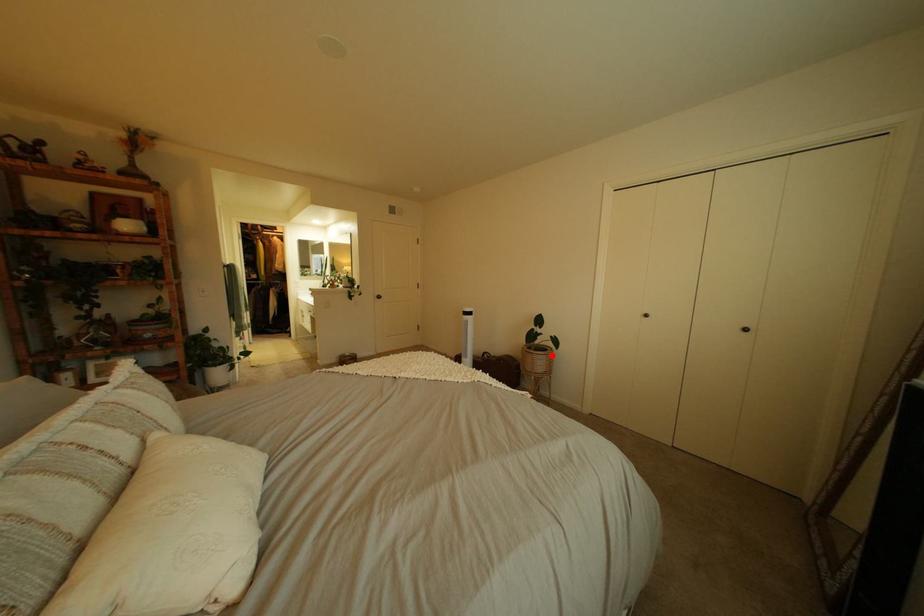
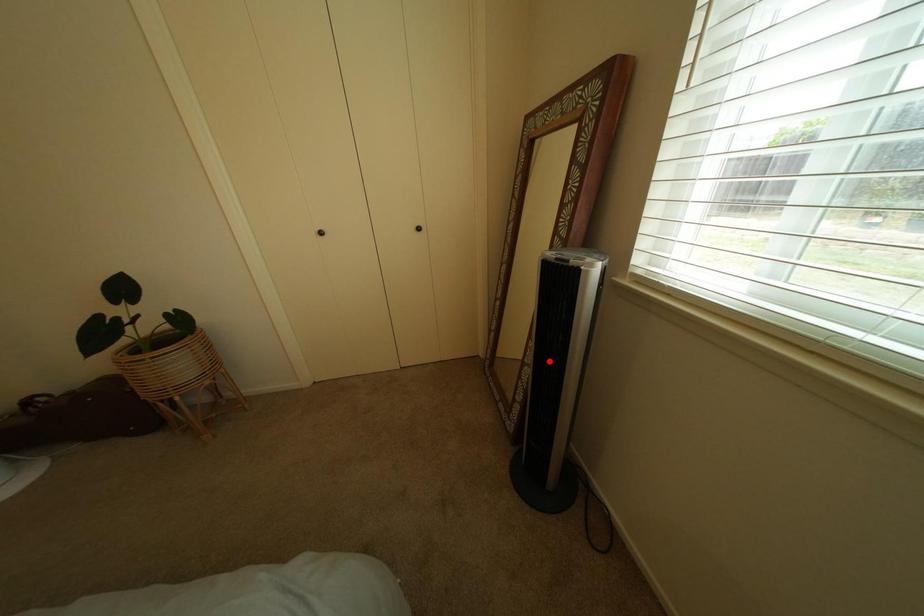
I am providing you with two images of the same scene from different viewpoints. A red point is marked on the first image and another point is marked on the second image. Does the point marked in image1 correspond to the same location as the one in image2?

No